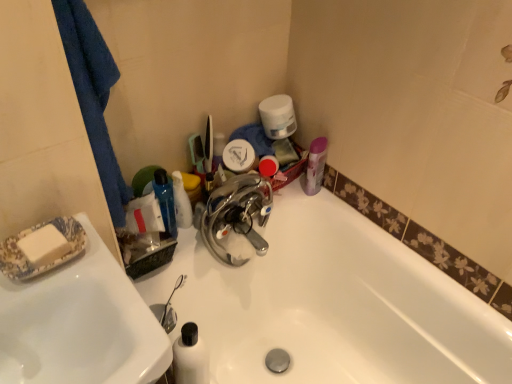
Question: Is blue fabric towel at left far from white glossy bottle at upper center?

Choices:
 (A) yes
 (B) no

Answer: (B)

Question: Can you confirm if blue fabric towel at left is bigger than white glossy bottle at upper center?

Choices:
 (A) no
 (B) yes

Answer: (B)

Question: Is blue fabric towel at left surrounding white glossy bottle at upper center?

Choices:
 (A) no
 (B) yes

Answer: (A)

Question: Can you confirm if blue fabric towel at left is positioned to the left of white glossy bottle at upper center?

Choices:
 (A) no
 (B) yes

Answer: (B)

Question: Is blue fabric towel at left in contact with white glossy bottle at upper center?

Choices:
 (A) yes
 (B) no

Answer: (B)

Question: In the image, is white matte toilet paper at upper center on the left side or the right side of white glossy sink at left?

Choices:
 (A) left
 (B) right

Answer: (B)

Question: Considering the positions of white matte toilet paper at upper center and white glossy sink at left in the image, is white matte toilet paper at upper center wider or thinner than white glossy sink at left?

Choices:
 (A) thin
 (B) wide

Answer: (A)

Question: Does point (281, 107) appear closer or farther from the camera than point (97, 375)?

Choices:
 (A) closer
 (B) farther

Answer: (B)

Question: Relative to white glossy sink at left, is white matte toilet paper at upper center in front or behind?

Choices:
 (A) front
 (B) behind

Answer: (B)

Question: Considering the relative positions of blue fabric towel at left and white matte toilet paper at upper center in the image provided, is blue fabric towel at left to the left or to the right of white matte toilet paper at upper center?

Choices:
 (A) left
 (B) right

Answer: (A)

Question: Looking at their shapes, would you say blue fabric towel at left is wider or thinner than white matte toilet paper at upper center?

Choices:
 (A) thin
 (B) wide

Answer: (B)

Question: Looking at the image, does blue fabric towel at left seem bigger or smaller compared to white matte toilet paper at upper center?

Choices:
 (A) big
 (B) small

Answer: (A)

Question: Considering their positions, is blue fabric towel at left located in front of or behind white matte toilet paper at upper center?

Choices:
 (A) behind
 (B) front

Answer: (B)

Question: Is point (173, 185) closer or farther from the camera than point (276, 100)?

Choices:
 (A) closer
 (B) farther

Answer: (A)

Question: Based on their positions, is white glossy bottle at upper center located to the left or right of white matte toilet paper at upper center?

Choices:
 (A) left
 (B) right

Answer: (A)